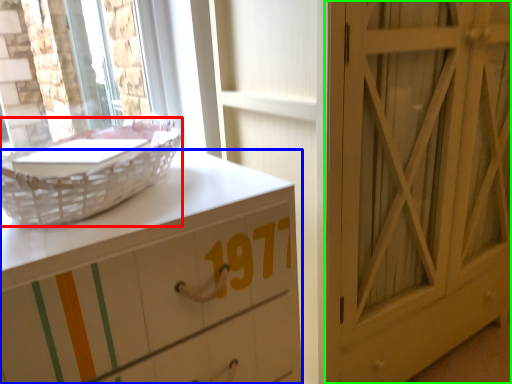
Question: Which object is positioned farthest from basket (highlighted by a red box)? Select from chest of drawers (highlighted by a blue box) and door (highlighted by a green box).

Choices:
 (A) chest of drawers
 (B) door

Answer: (B)